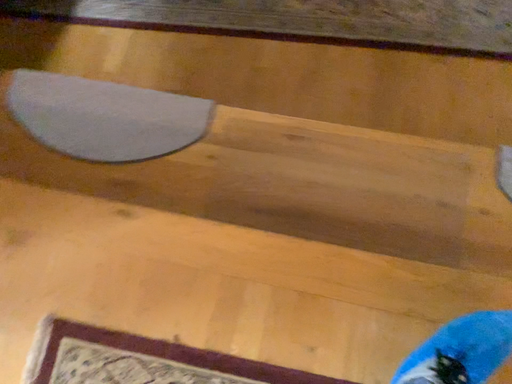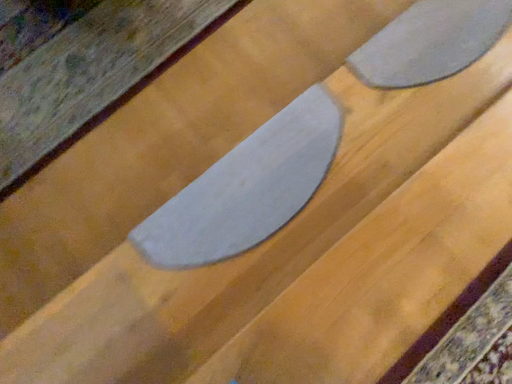
Question: How did the camera likely rotate when shooting the video?

Choices:
 (A) rotated left
 (B) rotated right

Answer: (B)